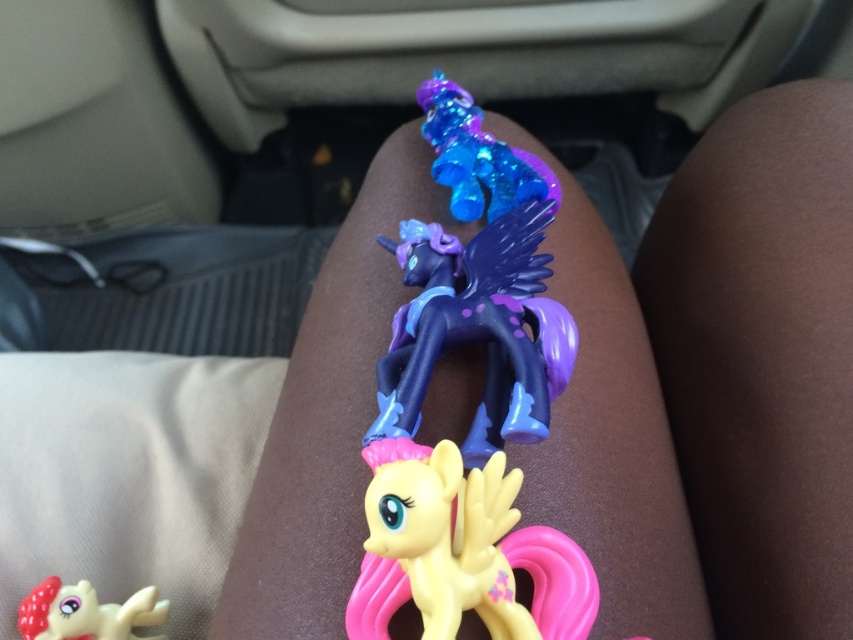
Question: Which of the following is the farthest from the observer?

Choices:
 (A) click(x=71, y=637)
 (B) click(x=488, y=417)
 (C) click(x=567, y=598)

Answer: (A)

Question: Is yellow matte plastic pony at center in front of glossy plastic unicorn at center?

Choices:
 (A) yes
 (B) no

Answer: (A)

Question: Can you confirm if glossy plastic unicorn at center is positioned below shiny plastic pony at lower left?

Choices:
 (A) yes
 (B) no

Answer: (B)

Question: Which point appears closest to the camera in this image?

Choices:
 (A) (413, 273)
 (B) (428, 561)

Answer: (B)

Question: From the image, what is the correct spatial relationship of yellow matte plastic pony at center in relation to glossy plastic unicorn at center?

Choices:
 (A) above
 (B) below

Answer: (B)

Question: Which of the following is the farthest from the observer?

Choices:
 (A) (448, 300)
 (B) (461, 552)
 (C) (122, 630)

Answer: (C)